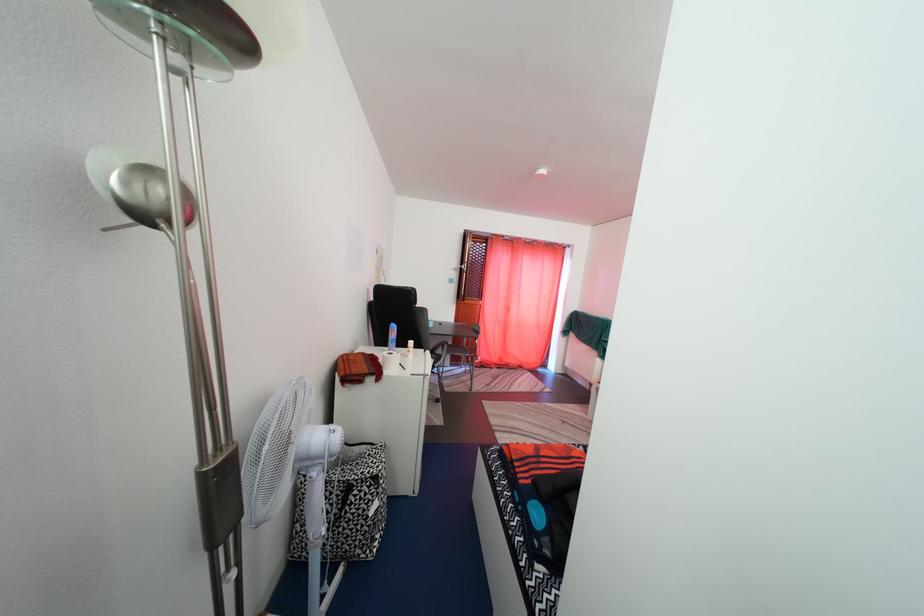
Find where to pull the red door curtain. Please return your answer as a coordinate pair (x, y).

(517, 302)